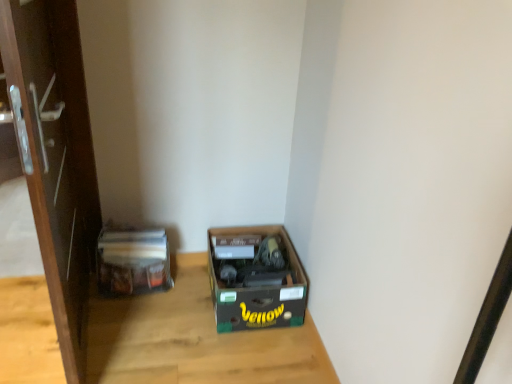
Describe the element at coordinates (194, 339) in the screenshot. The height and width of the screenshot is (384, 512). I see `wooden table at center` at that location.

This screenshot has width=512, height=384. In order to click on matte plastic bag at left in this screenshot , I will do `click(132, 261)`.

In order to face brown glossy door at left, should I rotate leftwards or rightwards?

You should look left and rotate roughly 24.394 degrees.

Describe the element at coordinates (55, 156) in the screenshot. I see `brown glossy door at left` at that location.

Identify the location of brown cardboard box at lower center. (256, 278).

Considering the points (53, 239) and (212, 305), which point is behind, point (53, 239) or point (212, 305)?

The point (212, 305) is behind.

Could you tell me if brown glossy door at left is turned towards wooden table at center?

No, brown glossy door at left is not aimed at wooden table at center.

Based on the photo, is brown glossy door at left to the left of wooden table at center from the viewer's perspective?

Yes, brown glossy door at left is to the left of wooden table at center.

Is brown glossy door at left not close to wooden table at center?

brown glossy door at left is near wooden table at center, not far away.

Based on the photo, how many degrees apart are the facing directions of brown cardboard box at lower center and brown glossy door at left?

83.3 degrees.

Is brown cardboard box at lower center inside or outside of brown glossy door at left?

brown cardboard box at lower center exists outside the volume of brown glossy door at left.

Are brown cardboard box at lower center and brown glossy door at left located far from each other?

No, brown cardboard box at lower center is in close proximity to brown glossy door at left.

From the image's perspective, which one is positioned lower, matte plastic bag at left or brown glossy door at left?

matte plastic bag at left.

From a real-world perspective, is matte plastic bag at left located higher than brown glossy door at left?

Actually, matte plastic bag at left is physically below brown glossy door at left in the real world.

Does matte plastic bag at left have a greater height compared to brown glossy door at left?

No.

Is the surface of matte plastic bag at left in direct contact with wooden table at center?

matte plastic bag at left is not next to wooden table at center, and they're not touching.

Would you say matte plastic bag at left is outside wooden table at center?

matte plastic bag at left is positioned outside wooden table at center.

Does matte plastic bag at left lie in front of wooden table at center?

No, it is behind wooden table at center.

Which of these two, matte plastic bag at left or wooden table at center, is smaller?

With smaller size is matte plastic bag at left.

Is brown cardboard box at lower center oriented towards wooden table at center?

No, brown cardboard box at lower center does not turn towards wooden table at center.

Between brown cardboard box at lower center and wooden table at center, which one is positioned behind?

Positioned behind is brown cardboard box at lower center.

Is brown cardboard box at lower center wider than wooden table at center?

Incorrect, the width of brown cardboard box at lower center does not surpass that of wooden table at center.

Is brown cardboard box at lower center surrounding wooden table at center?

Actually, wooden table at center is outside brown cardboard box at lower center.

What's the angular difference between brown glossy door at left and brown cardboard box at lower center's facing directions?

83.3 degrees separate the facing orientations of brown glossy door at left and brown cardboard box at lower center.

Relative to brown cardboard box at lower center, is brown glossy door at left in front or behind?

Clearly, brown glossy door at left is in front of brown cardboard box at lower center.

Is brown glossy door at left situated inside brown cardboard box at lower center or outside?

brown glossy door at left is not enclosed by brown cardboard box at lower center.

From a real-world perspective, relative to brown cardboard box at lower center, is brown glossy door at left vertically above or below?

Clearly, from a real-world perspective, brown glossy door at left is above brown cardboard box at lower center.

Is wooden table at center to the left of matte plastic bag at left from the viewer's perspective?

No, wooden table at center is not to the left of matte plastic bag at left.

How much distance is there between wooden table at center and matte plastic bag at left?

wooden table at center and matte plastic bag at left are 11.28 inches apart from each other.

From a real-world perspective, who is located higher, wooden table at center or matte plastic bag at left?

matte plastic bag at left is physically above.

Is matte plastic bag at left a part of wooden table at center?

No, matte plastic bag at left is not inside wooden table at center.

Find the location of `door that is above the wooden table at center (from the image's perspective)`. door that is above the wooden table at center (from the image's perspective) is located at coordinates (55, 156).

In the image, there is a brown glossy door at left. At what (x,y) coordinates should I click in order to perform the action: click on box below it (from the image's perspective). Please return your answer as a coordinate pair (x, y). The width and height of the screenshot is (512, 384). Looking at the image, I should click on coord(256,278).

Looking at the image, which one is located closer to brown glossy door at left, wooden table at center or matte plastic bag at left?

matte plastic bag at left is closer to brown glossy door at left.

Based on their spatial positions, is brown cardboard box at lower center or matte plastic bag at left closer to wooden table at center?

Based on the image, brown cardboard box at lower center appears to be nearer to wooden table at center.

Based on their spatial positions, is brown cardboard box at lower center or matte plastic bag at left further from brown glossy door at left?

brown cardboard box at lower center lies further to brown glossy door at left than the other object.

Estimate the real-world distances between objects in this image. Which object is closer to brown cardboard box at lower center, brown glossy door at left or matte plastic bag at left?

Among the two, matte plastic bag at left is located nearer to brown cardboard box at lower center.

Looking at the image, which one is located closer to brown glossy door at left, matte plastic bag at left or brown cardboard box at lower center?

Among the two, matte plastic bag at left is located nearer to brown glossy door at left.

Looking at the image, which one is located closer to brown cardboard box at lower center, matte plastic bag at left or wooden table at center?

wooden table at center is closer to brown cardboard box at lower center.

In the scene shown: Based on their spatial positions, is brown cardboard box at lower center or brown glossy door at left closer to wooden table at center?

Among the two, brown cardboard box at lower center is located nearer to wooden table at center.

Considering their positions, is brown glossy door at left positioned further to matte plastic bag at left than wooden table at center?

Among the two, brown glossy door at left is located further to matte plastic bag at left.

Where is `table situated between matte plastic bag at left and brown cardboard box at lower center from left to right`? The height and width of the screenshot is (384, 512). table situated between matte plastic bag at left and brown cardboard box at lower center from left to right is located at coordinates (194, 339).

Identify the location of box located between brown glossy door at left and matte plastic bag at left in the depth direction. (256, 278).

The width and height of the screenshot is (512, 384). In order to click on table positioned between brown glossy door at left and brown cardboard box at lower center from near to far in this screenshot , I will do `click(194, 339)`.

This screenshot has width=512, height=384. I want to click on table between brown glossy door at left and matte plastic bag at left in the front-back direction, so click(x=194, y=339).